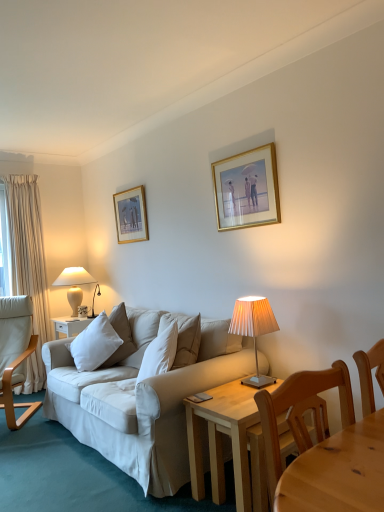
Question: In terms of height, does light wood table at lower right look taller or shorter compared to white ceramic lamp at left, which is counted as the 1th lamp, starting from the back?

Choices:
 (A) tall
 (B) short

Answer: (A)

Question: Is light wood table at lower right wider or thinner than white ceramic lamp at left, which ranks as the 1th lamp in left-to-right order?

Choices:
 (A) wide
 (B) thin

Answer: (A)

Question: Which object is positioned closest to the white ceramic lamp at left, the second lamp in the right-to-left sequence?

Choices:
 (A) light brown wooden chair at lower right, placed as the second chair when sorted from left to right
 (B) pleated beige lampshade at center, arranged as the second lamp when viewed from the back
 (C) gold metallic picture frame at upper center, acting as the second picture frame starting from the left
 (D) white soft pillow at left
 (E) light brown wood chair at left, placed as the 2th chair when sorted from front to back

Answer: (E)

Question: Which is nearer to the gold-framed picture at upper center, which is counted as the 1th picture frame, starting from the back?

Choices:
 (A) light wood table at lower right
 (B) gold metallic picture frame at upper center, which is the first picture frame from right to left
 (C) light brown wood chair at left, which is the first chair in left-to-right order
 (D) white soft pillow at left
 (E) white ceramic lamp at left, which ranks as the 1th lamp in left-to-right order

Answer: (E)